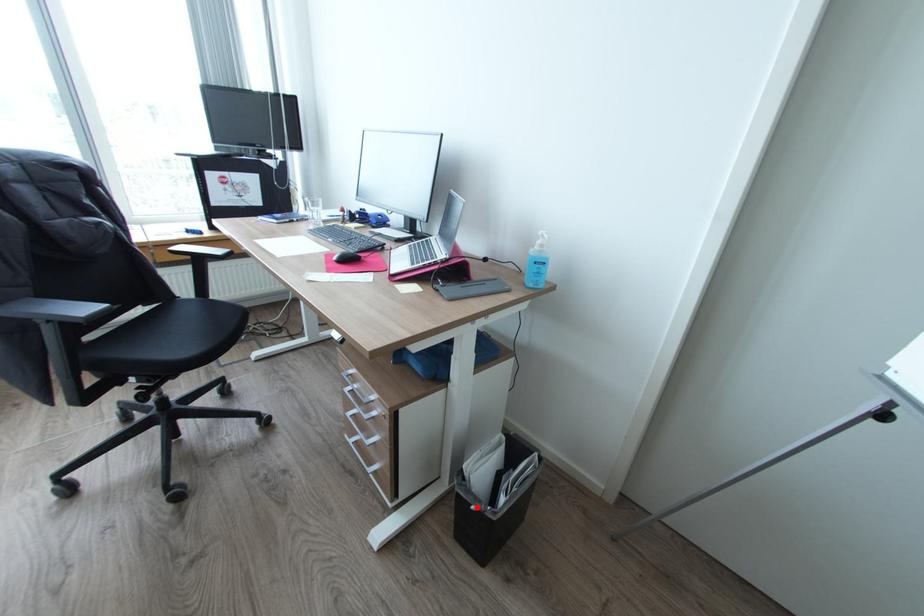
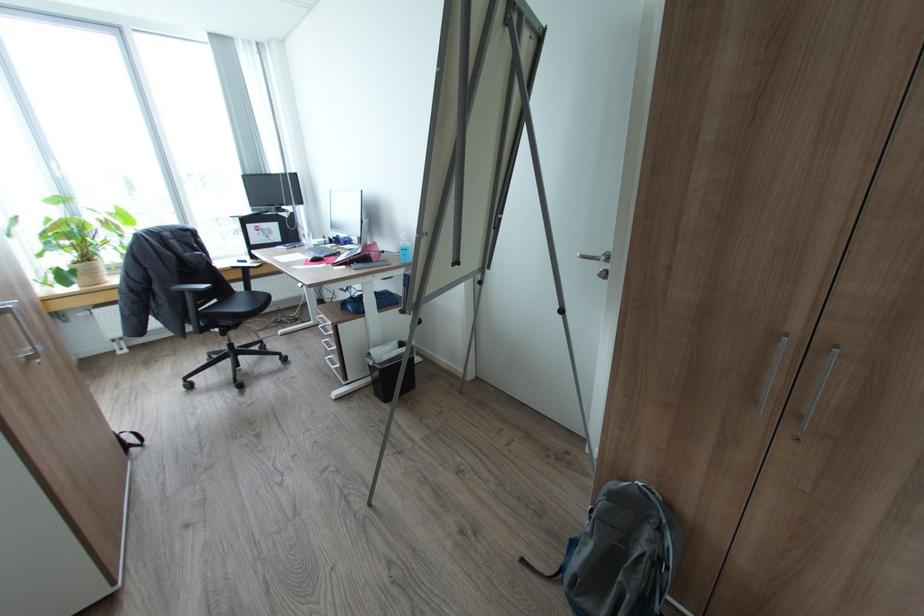
Locate, in the second image, the point that corresponds to the highlighted location in the first image.

(374, 363)